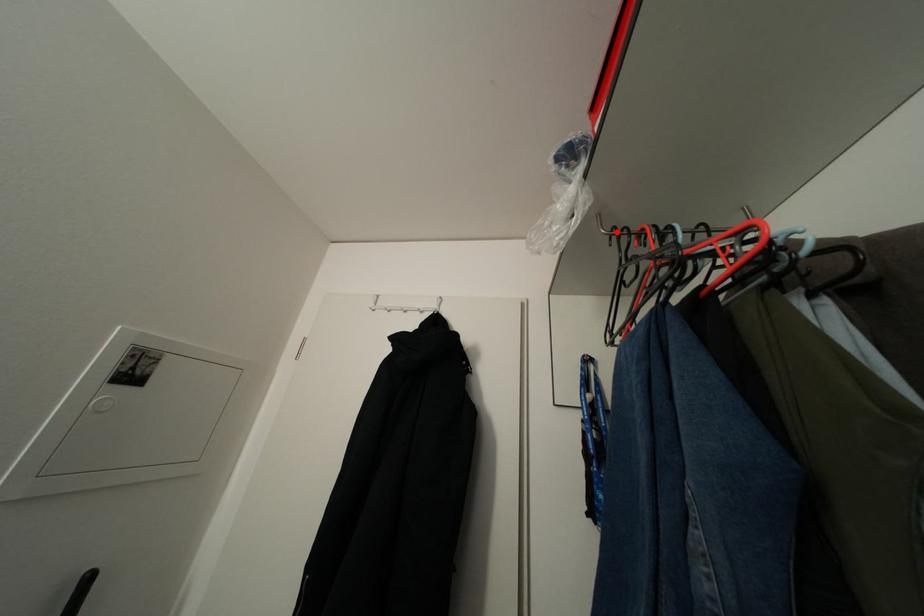
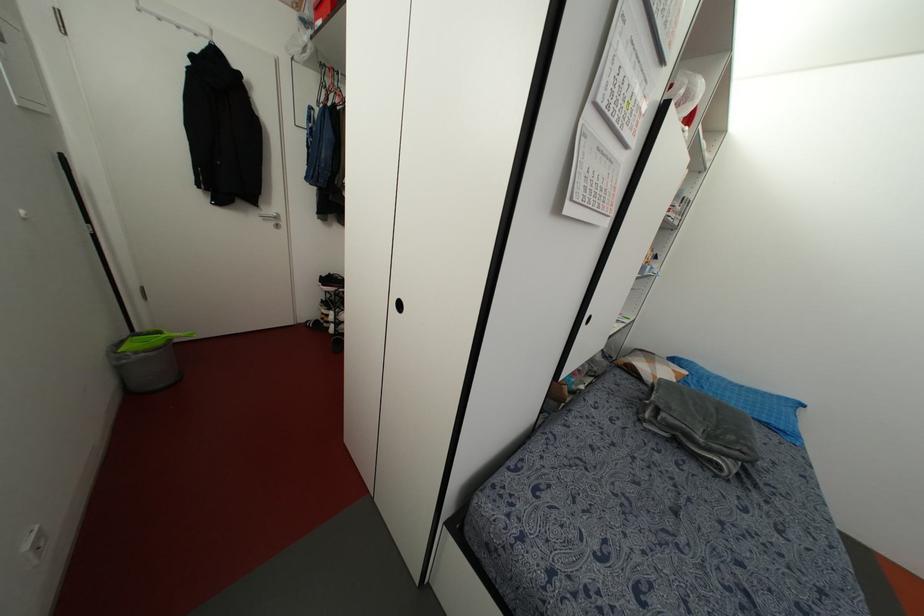
In the second image, find the point that corresponds to the highlighted location in the first image.

(322, 63)